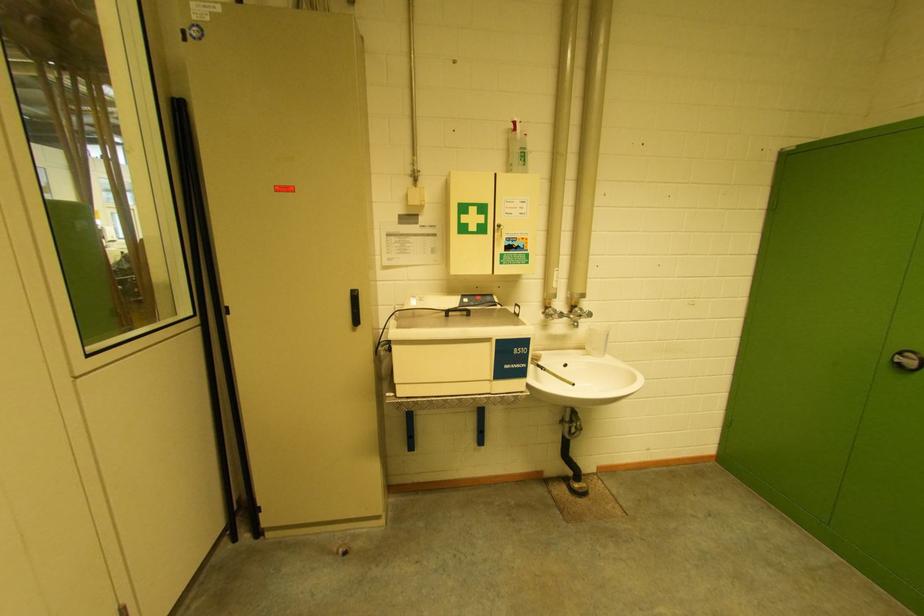
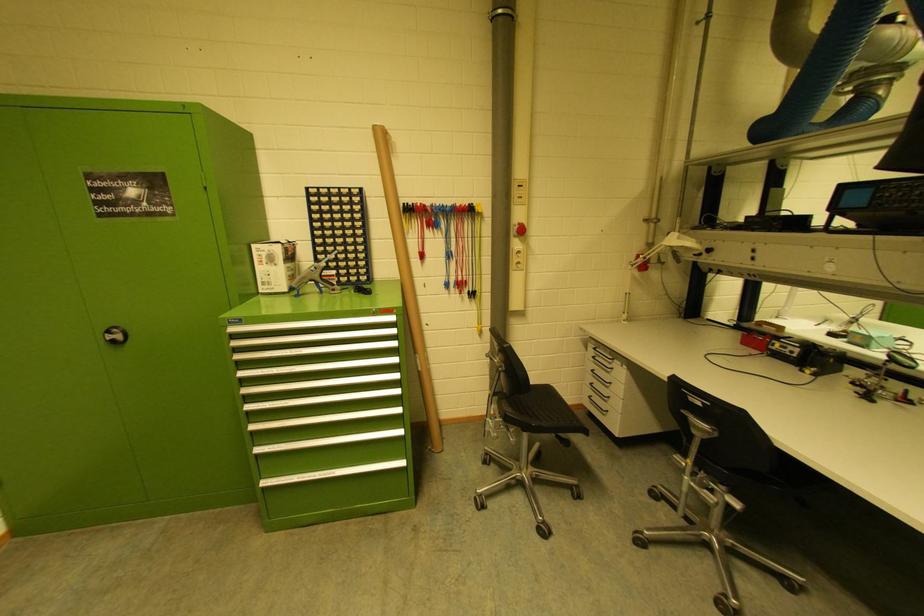
First-person continuous shooting, in which direction is the camera rotating?

The camera's rotation is toward right-down.